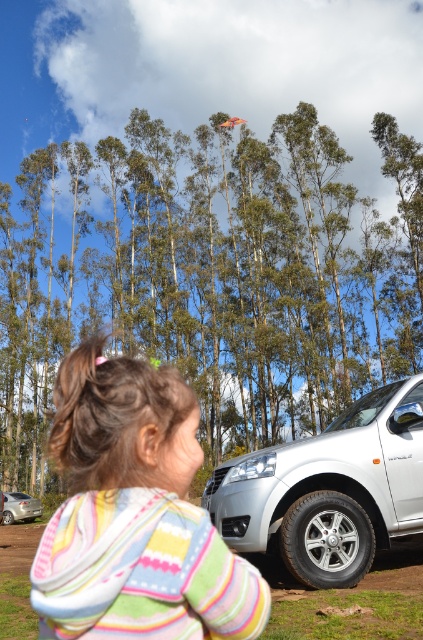
Between striped hoodie at lower left and silver metallic sedan at lower left, which one has less height?

striped hoodie at lower left is shorter.

Is striped hoodie at lower left behind silver metallic sedan at lower left?

That is False.

Is point (180, 392) closer to camera compared to point (24, 493)?

Yes, point (180, 392) is in front of point (24, 493).

Locate an element on the screen. This screenshot has width=423, height=640. striped hoodie at lower left is located at coordinates (134, 515).

Who is positioned more to the left, striped hoodie at lower left or silver metallic suv at lower right?

striped hoodie at lower left

Between striped hoodie at lower left and silver metallic suv at lower right, which one has less height?

striped hoodie at lower left

Who is more forward, (74, 556) or (224, 461)?

Point (74, 556) is in front.

Where is `striped hoodie at lower left`? Image resolution: width=423 pixels, height=640 pixels. striped hoodie at lower left is located at coordinates (134, 515).

Is silver metallic suv at lower right above silver metallic sedan at lower left?

Correct, silver metallic suv at lower right is located above silver metallic sedan at lower left.

Does point (353, 504) lie behind point (22, 506)?

That is False.

You are a GUI agent. You are given a task and a screenshot of the screen. Output one action in this format:
    pyautogui.click(x=<x>, y=<y>)
    Task: Click on the silver metallic suv at lower right
    
    Given the screenshot: What is the action you would take?
    pyautogui.click(x=329, y=490)